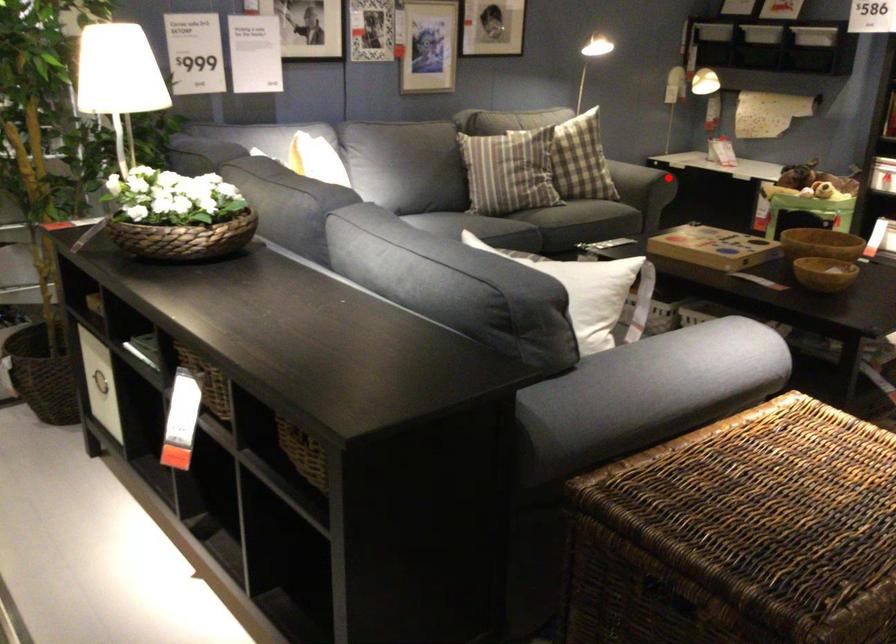
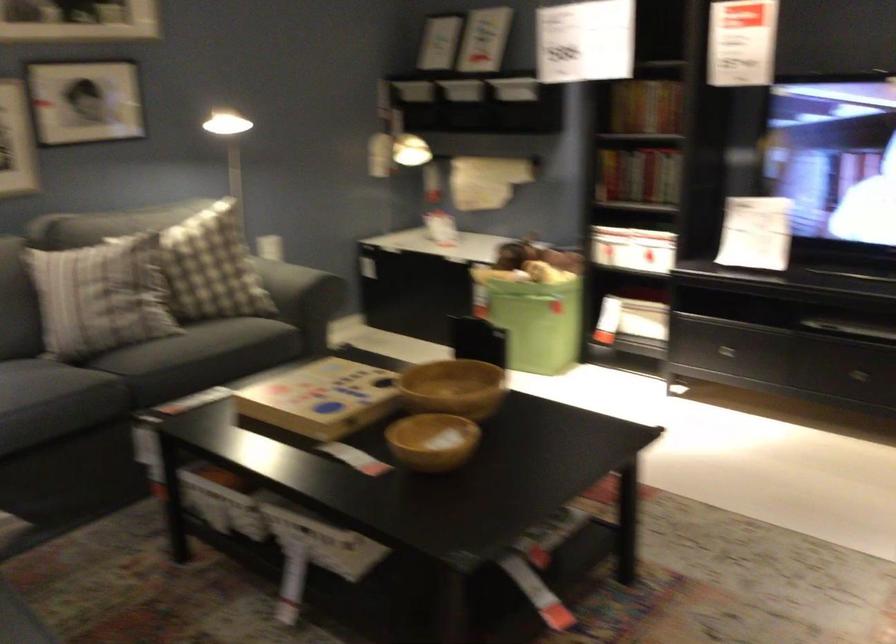
Question: I am providing you with two images of the same scene from different viewpoints. A red point is shown in image1. For the corresponding object point in image2, is it positioned nearer or farther from the camera?

Choices:
 (A) Nearer
 (B) Farther

Answer: (A)